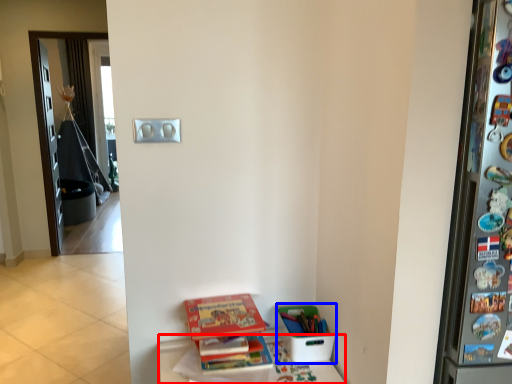
Question: Which point is closer to the camera, furniture (highlighted by a red box) or box (highlighted by a blue box)?

Choices:
 (A) furniture
 (B) box

Answer: (A)